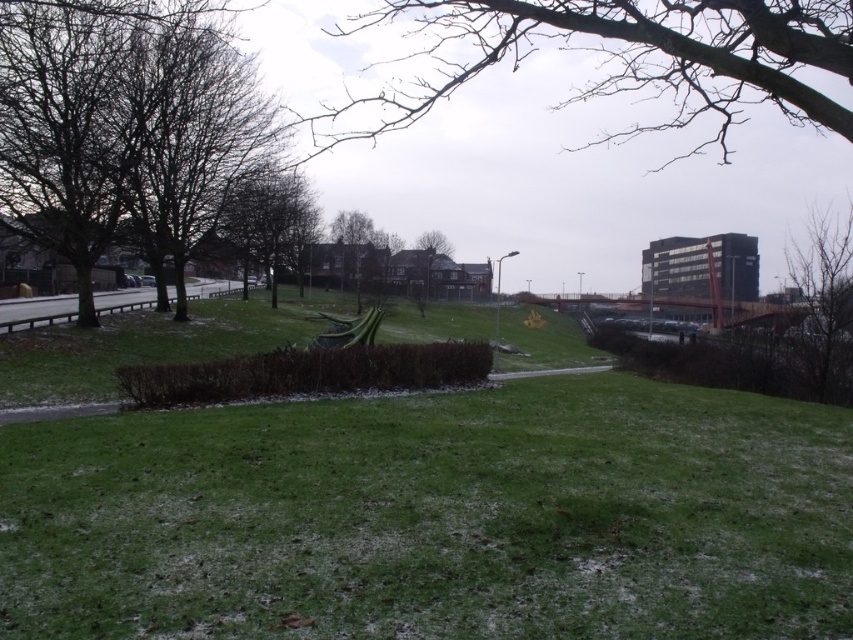
Who is shorter, green grass at center or brown wood tree at center?

With less height is green grass at center.

Who is taller, green grass at center or brown wood tree at center?

brown wood tree at center

Is point (764, 627) behind point (433, 241)?

No, (764, 627) is in front of (433, 241).

Locate an element on the screen. The image size is (853, 640). green grass at center is located at coordinates click(434, 516).

Is point (761, 76) more distant than point (421, 241)?

No, it is in front of (421, 241).

Does bare branches at upper center have a larger size compared to brown wood tree at center?

Yes.

The image size is (853, 640). What do you see at coordinates (618, 58) in the screenshot?
I see `bare branches at upper center` at bounding box center [618, 58].

Find the location of a particular element. The height and width of the screenshot is (640, 853). bare branches at upper center is located at coordinates (618, 58).

This screenshot has height=640, width=853. Find the location of `green grass at center`. green grass at center is located at coordinates (434, 516).

Describe the element at coordinates (434, 516) in the screenshot. The image size is (853, 640). I see `green grass at center` at that location.

Which is behind, point (379, 397) or point (99, 61)?

The point (99, 61) is more distant.

Find the location of a particular element. Image resolution: width=853 pixels, height=640 pixels. green grass at center is located at coordinates point(434,516).